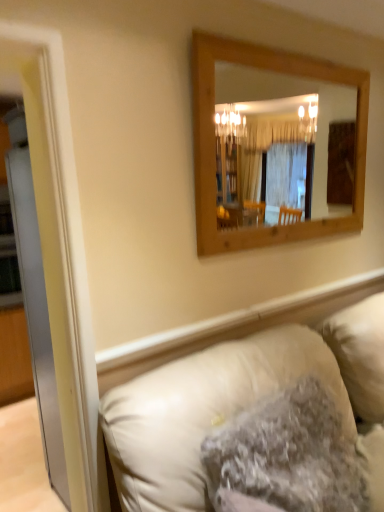
Question: Is white glossy door at left surrounded by leather couch at lower right?

Choices:
 (A) yes
 (B) no

Answer: (B)

Question: From a real-world perspective, is leather couch at lower right positioned under white glossy door at left based on gravity?

Choices:
 (A) yes
 (B) no

Answer: (A)

Question: From the image's perspective, is leather couch at lower right located beneath white glossy door at left?

Choices:
 (A) yes
 (B) no

Answer: (A)

Question: Considering the relative positions of leather couch at lower right and white glossy door at left in the image provided, is leather couch at lower right to the left of white glossy door at left from the viewer's perspective?

Choices:
 (A) yes
 (B) no

Answer: (B)

Question: Is leather couch at lower right thinner than white glossy door at left?

Choices:
 (A) yes
 (B) no

Answer: (B)

Question: Is leather couch at lower right at the right side of white glossy door at left?

Choices:
 (A) no
 (B) yes

Answer: (B)

Question: Is fuzzy beige pillow at lower center inside white glossy door at left?

Choices:
 (A) yes
 (B) no

Answer: (B)

Question: From the image's perspective, is white glossy door at left above fuzzy beige pillow at lower center?

Choices:
 (A) no
 (B) yes

Answer: (B)

Question: Is white glossy door at left turned away from fuzzy beige pillow at lower center?

Choices:
 (A) no
 (B) yes

Answer: (A)

Question: Is white glossy door at left beside fuzzy beige pillow at lower center?

Choices:
 (A) no
 (B) yes

Answer: (A)

Question: Does white glossy door at left have a lesser height compared to fuzzy beige pillow at lower center?

Choices:
 (A) no
 (B) yes

Answer: (A)

Question: From a real-world perspective, is white glossy door at left on top of fuzzy beige pillow at lower center?

Choices:
 (A) yes
 (B) no

Answer: (A)

Question: Is wooden mirror at upper center positioned behind fuzzy beige pillow at lower center?

Choices:
 (A) yes
 (B) no

Answer: (A)